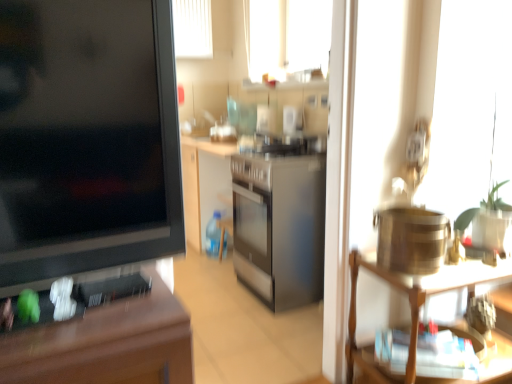
What do you see at coordinates (417, 294) in the screenshot? I see `wooden shelf at right` at bounding box center [417, 294].

Measure the distance between point (411, 342) and camera.

Point (411, 342) is 4.78 feet away from camera.

At what (x,y) coordinates should I click in order to perform the action: click on wooden shelf at right. Please return your answer as a coordinate pair (x, y). Looking at the image, I should click on (417, 294).

What do you see at coordinates (87, 138) in the screenshot? I see `wooden desk at left` at bounding box center [87, 138].

The height and width of the screenshot is (384, 512). Identify the location of wooden desk at left. (87, 138).

Locate an element on the screen. This screenshot has width=512, height=384. wooden shelf at right is located at coordinates (417, 294).

Which object is positioned more to the right, wooden desk at left or wooden shelf at right?

Positioned to the right is wooden shelf at right.

Is wooden desk at left closer to camera compared to wooden shelf at right?

Yes, wooden desk at left is in front of wooden shelf at right.

Considering the points (78, 232) and (350, 317), which point is in front, point (78, 232) or point (350, 317)?

Positioned in front is point (78, 232).

From the image's perspective, does wooden desk at left appear lower than wooden shelf at right?

Incorrect, from the image's perspective, wooden desk at left is higher than wooden shelf at right.

From a real-world perspective, is wooden desk at left positioned above or below wooden shelf at right?

A: wooden desk at left is above wooden shelf at right.

Looking at their sizes, would you say wooden desk at left is wider or thinner than wooden shelf at right?

wooden desk at left is thinner than wooden shelf at right.

Can you confirm if wooden desk at left is shorter than wooden shelf at right?

No.

Which of these two, wooden desk at left or wooden shelf at right, is smaller?

wooden desk at left.

Is wooden desk at left surrounding wooden shelf at right?

Actually, wooden shelf at right is outside wooden desk at left.

Would you consider wooden desk at left to be distant from wooden shelf at right?

No, wooden desk at left is not far from wooden shelf at right.

Is wooden shelf at right at the back of wooden desk at left?

No, wooden desk at left is not facing the opposite direction of wooden shelf at right.

Can you tell me how much wooden desk at left and wooden shelf at right differ in facing direction?

There is a 5.57-degree angle between the facing directions of wooden desk at left and wooden shelf at right.

In the image, there is a wooden desk at left. At what (x,y) coordinates should I click in order to perform the action: click on shelf below it (from a real-world perspective). Please return your answer as a coordinate pair (x, y). This screenshot has width=512, height=384. Looking at the image, I should click on (417, 294).

Is wooden shelf at right to the left of wooden desk at left from the viewer's perspective?

In fact, wooden shelf at right is to the right of wooden desk at left.

Relative to wooden desk at left, is wooden shelf at right in front or behind?

In the image, wooden shelf at right appears behind wooden desk at left.

Which point is more distant from viewer, (497, 280) or (170, 189)?

The point (497, 280) is behind.

From the picture: From the image's perspective, is wooden shelf at right above or below wooden desk at left?

Clearly, from the image's perspective, wooden shelf at right is below wooden desk at left.

From the picture: From a real-world perspective, which is physically above, wooden shelf at right or wooden desk at left?

From a 3D spatial view, wooden desk at left is above.

Considering the sizes of objects wooden shelf at right and wooden desk at left in the image provided, who is wider, wooden shelf at right or wooden desk at left?

With larger width is wooden shelf at right.

In the scene shown: Is wooden shelf at right shorter than wooden desk at left?

Indeed, wooden shelf at right has a lesser height compared to wooden desk at left.

Is wooden shelf at right bigger or smaller than wooden desk at left?

In the image, wooden shelf at right appears to be larger than wooden desk at left.

Can wooden desk at left be found inside wooden shelf at right?

That's incorrect, wooden desk at left is not inside wooden shelf at right.

Is there a large distance between wooden shelf at right and wooden desk at left?

They are positioned close to each other.

Could you tell me if wooden shelf at right is turned towards wooden desk at left?

No, wooden shelf at right is not turned towards wooden desk at left.

What's the angular difference between wooden shelf at right and wooden desk at left's facing directions?

The facing directions of wooden shelf at right and wooden desk at left are 5.57 degrees apart.

Locate an element on the screen. This screenshot has width=512, height=384. shelf behind the wooden desk at left is located at coordinates (417, 294).

At what (x,y) coordinates should I click in order to perform the action: click on shelf that is behind the wooden desk at left. Please return your answer as a coordinate pair (x, y). The image size is (512, 384). Looking at the image, I should click on (417, 294).

The width and height of the screenshot is (512, 384). I want to click on shelf located below the wooden desk at left (from the image's perspective), so click(x=417, y=294).